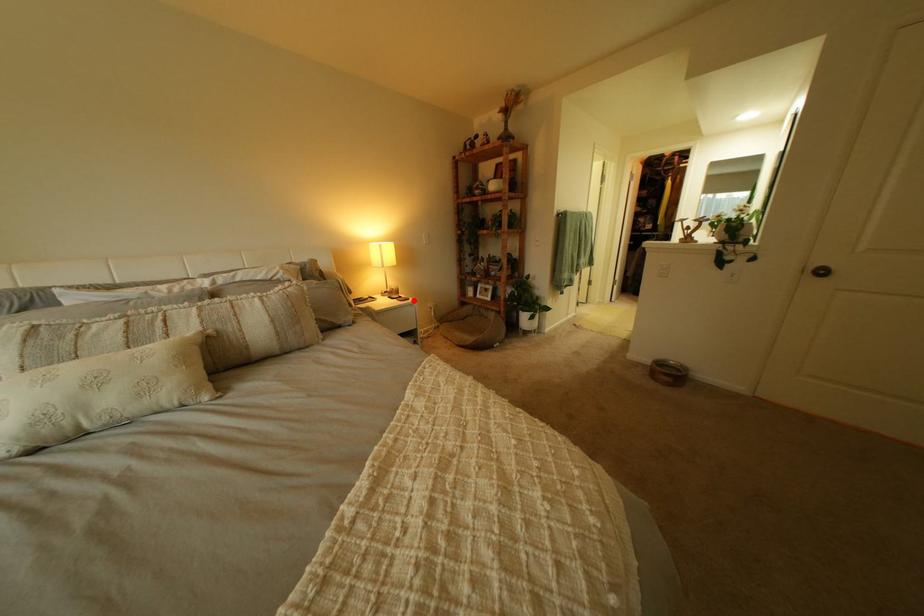
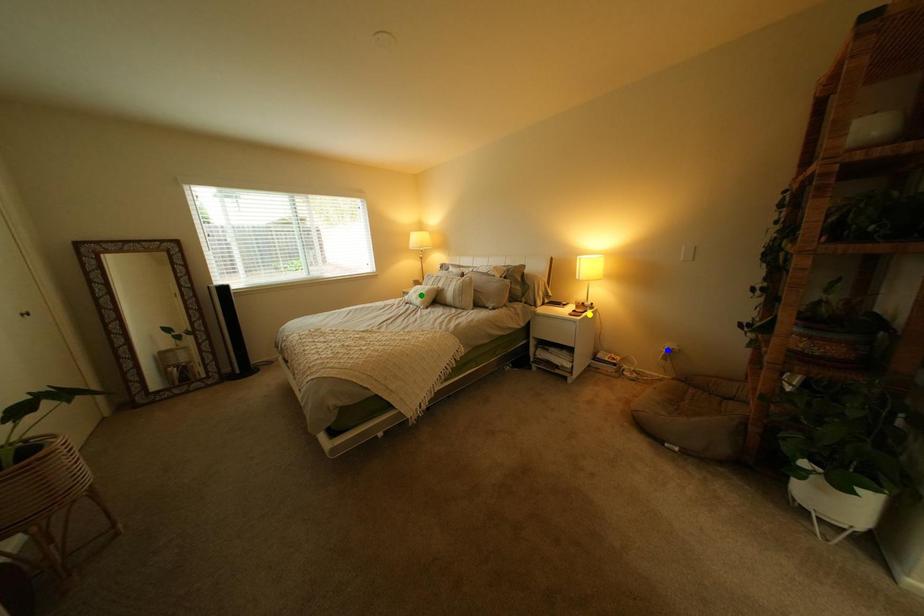
Question: I am providing you with two images of the same scene from different viewpoints. A red point is marked on the first image. You are given multiple points on the second image. Which point in image 2 is actually the same real-world point as the red point in image 1?

Choices:
 (A) yellow point
 (B) green point
 (C) blue point

Answer: (A)